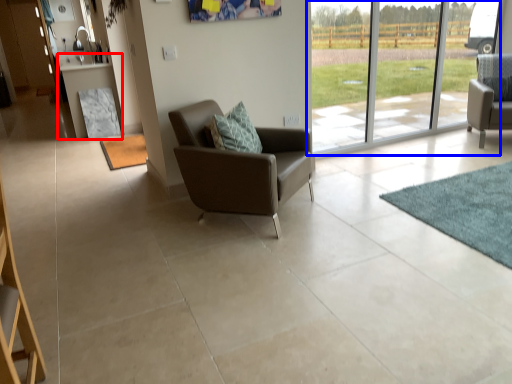
Question: Which of the following is the closest to the observer, table (highlighted by a red box) or window (highlighted by a blue box)?

Choices:
 (A) table
 (B) window

Answer: (B)